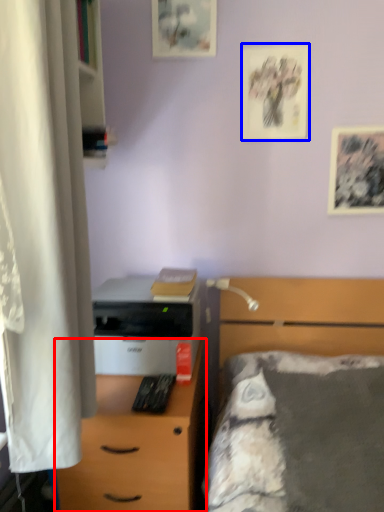
Question: Which of the following is the farthest to the observer, desk (highlighted by a red box) or picture frame (highlighted by a blue box)?

Choices:
 (A) desk
 (B) picture frame

Answer: (B)